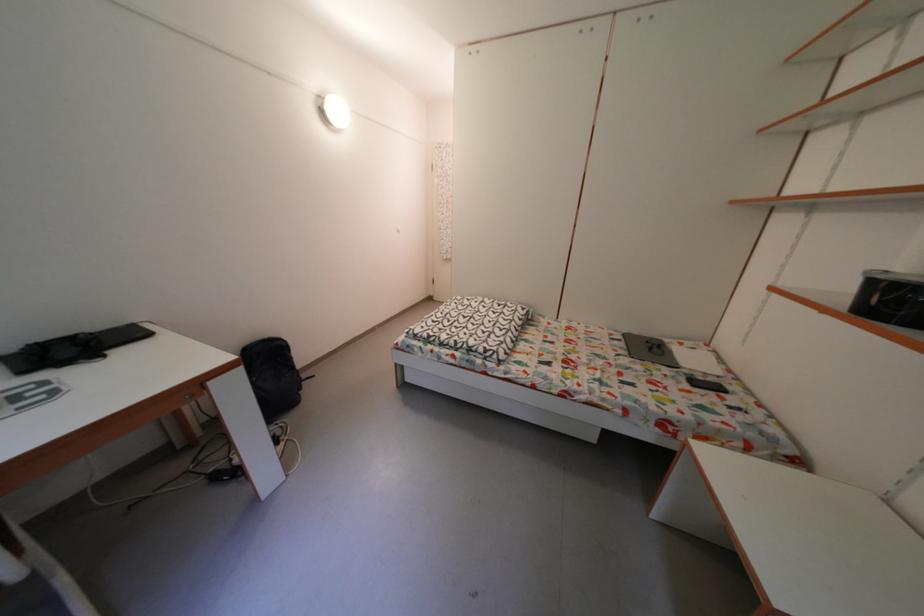
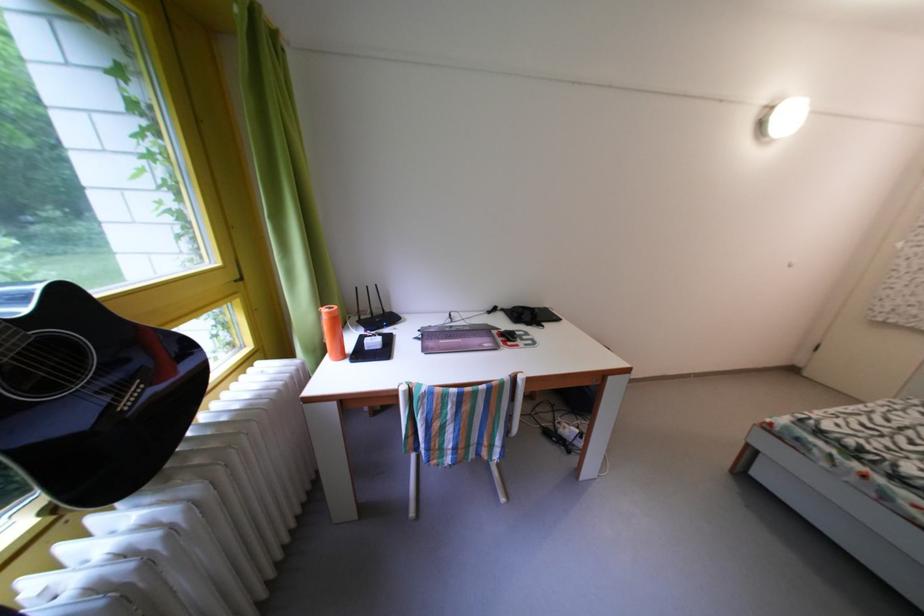
Question: Based on the continuous images, in which direction is the camera rotating? Reply with the corresponding letter.

Choices:
 (A) Left
 (B) Right
 (C) Up
 (D) Down

Answer: (A)